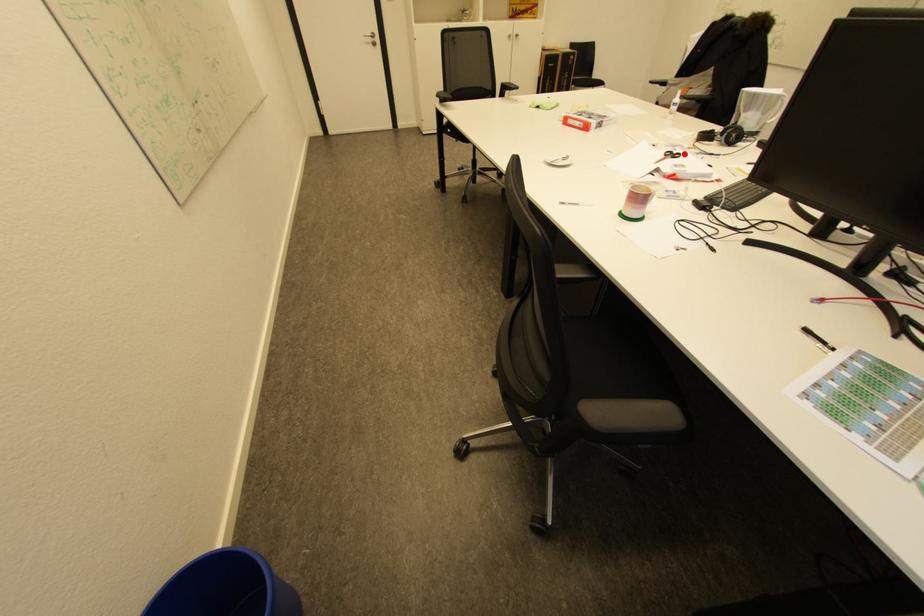
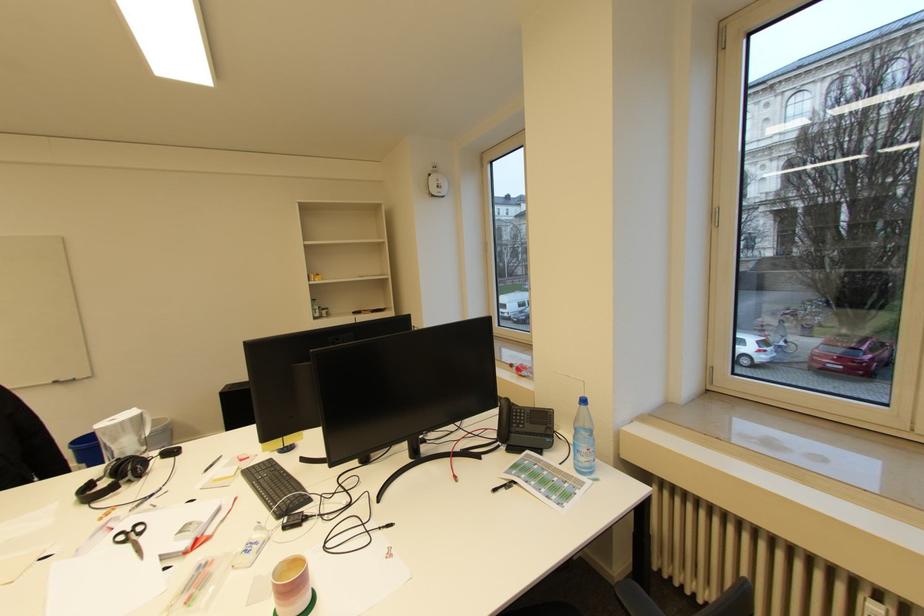
Where in the second image is the point corresponding to the highlighted location from the first image?

(141, 525)